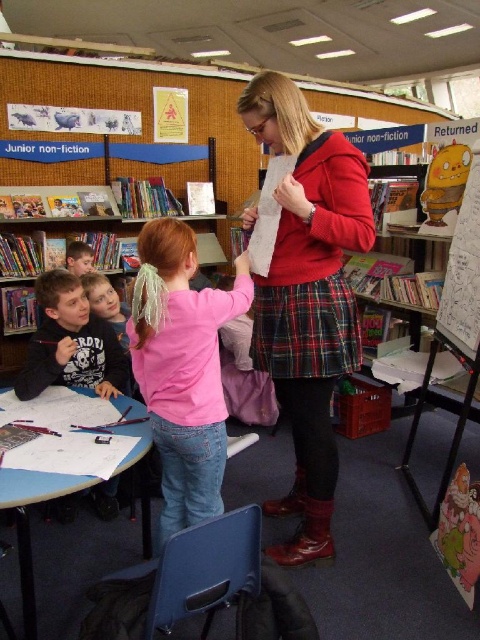
You are an interior designer planning to place a new sofa that is 1.2 meters wide in this room. You see the matte black shirt at left and the wooden bookshelf at left. Which object can the sofa fit next to without overlapping?

The sofa can fit next to the wooden bookshelf at left because its width is greater than the matte black shirt at left, so the bookshelf provides enough space.

You are a librarian who needs to determine if the pink matte shirt at center and the cartoon paperboard at right can both fit on a shelf that can hold items up to 1 meter in combined size. What should you do?

The pink matte shirt at center is bigger than the cartoon paperboard at right. However, since the combined size of both items is not provided, it is impossible to determine if they will fit together on the shelf. You should measure both items individually and add their sizes to check against the 1 meter limit.

You are a librarian trying to help a child find a book. You see the pink matte shirt at center and the matte black shirt at left. Which shirt is nearer to you?

The pink matte shirt at center is closer to the viewer than the matte black shirt at left, so the pink matte shirt at center is nearer to you.